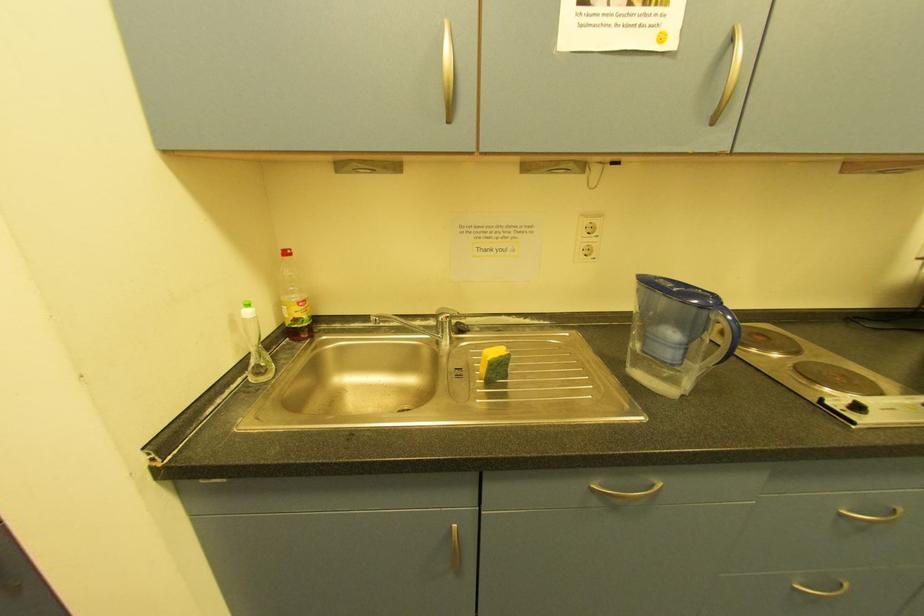
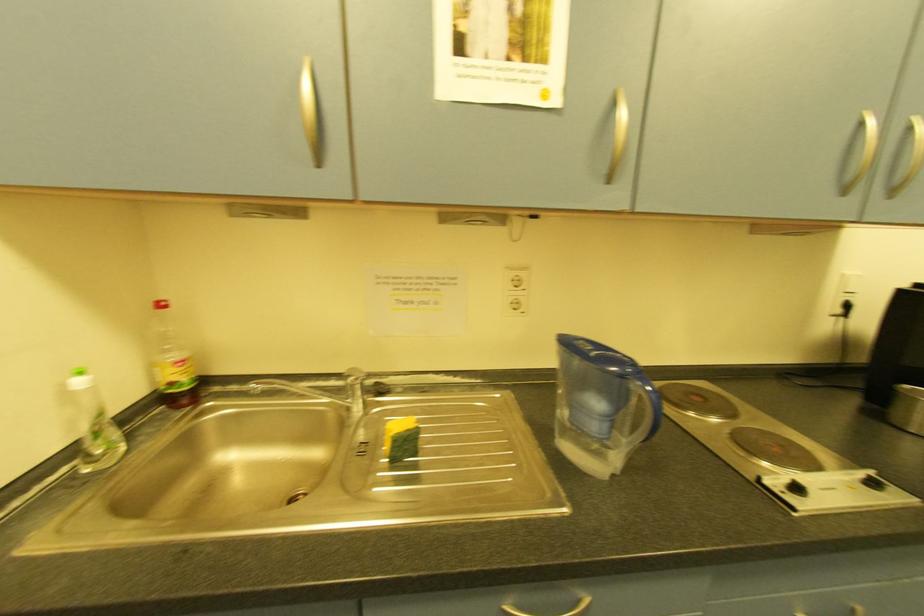
Question: Based on the continuous images, in which direction is the camera rotating? Reply with the corresponding letter.

Choices:
 (A) Left
 (B) Right
 (C) Up
 (D) Down

Answer: (C)